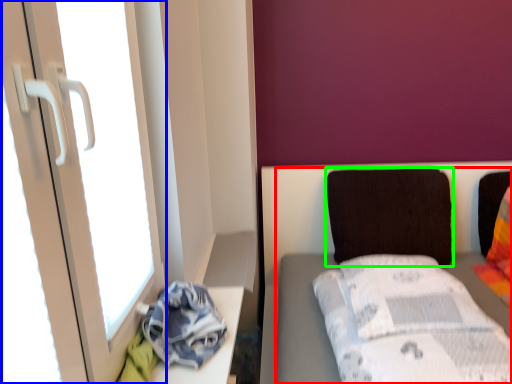
Question: Estimate the real-world distances between objects in this image. Which object is closer to furniture (highlighted by a red box), screen door (highlighted by a blue box) or pillow (highlighted by a green box)?

Choices:
 (A) screen door
 (B) pillow

Answer: (B)